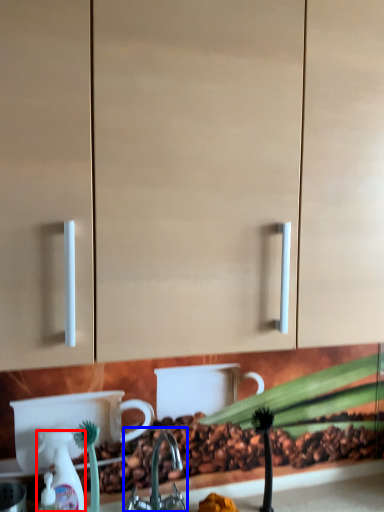
Question: Which of the following is the farthest to the observer, soap dispenser (highlighted by a red box) or tap (highlighted by a blue box)?

Choices:
 (A) soap dispenser
 (B) tap

Answer: (A)